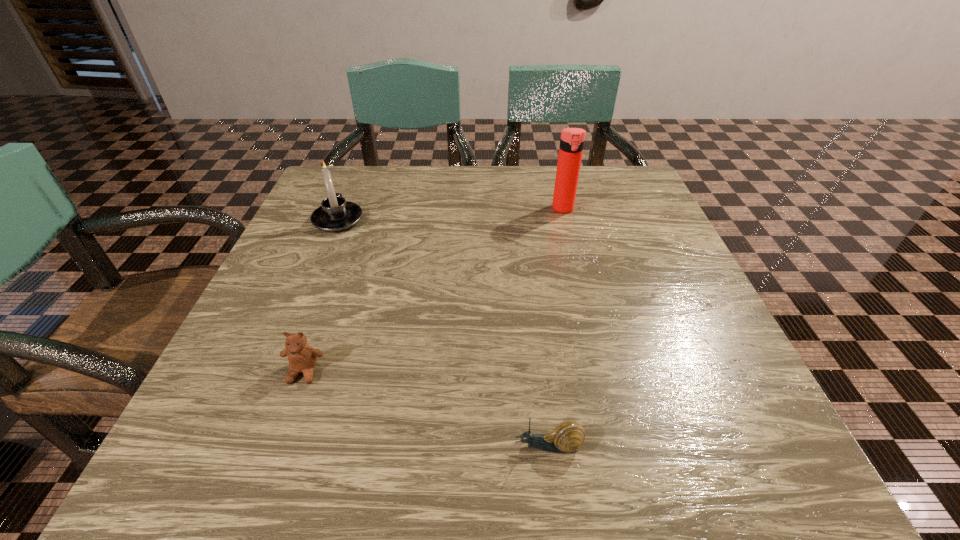
Where is `thermos bottle`? thermos bottle is located at coordinates (572, 140).

This screenshot has height=540, width=960. I want to click on the rightmost object, so click(572, 140).

The width and height of the screenshot is (960, 540). I want to click on the third shortest object, so click(335, 214).

The width and height of the screenshot is (960, 540). I want to click on the second nearest object, so click(302, 358).

This screenshot has height=540, width=960. I want to click on teddy bear, so click(x=302, y=358).

This screenshot has height=540, width=960. I want to click on escargot, so click(x=568, y=436).

Find the location of a particular element. the shortest object is located at coordinates (568, 436).

At what (x,y) coordinates should I click in order to perform the action: click on vacant region located on the right of the rightmost object. Please return your answer as a coordinate pair (x, y). Looking at the image, I should click on (642, 209).

This screenshot has width=960, height=540. I want to click on free region located 0.100m with a handle on the side of the third shortest object, so click(352, 185).

Find the location of `vacant area situated with a handle on the side of the third shortest object`. vacant area situated with a handle on the side of the third shortest object is located at coordinates (352, 185).